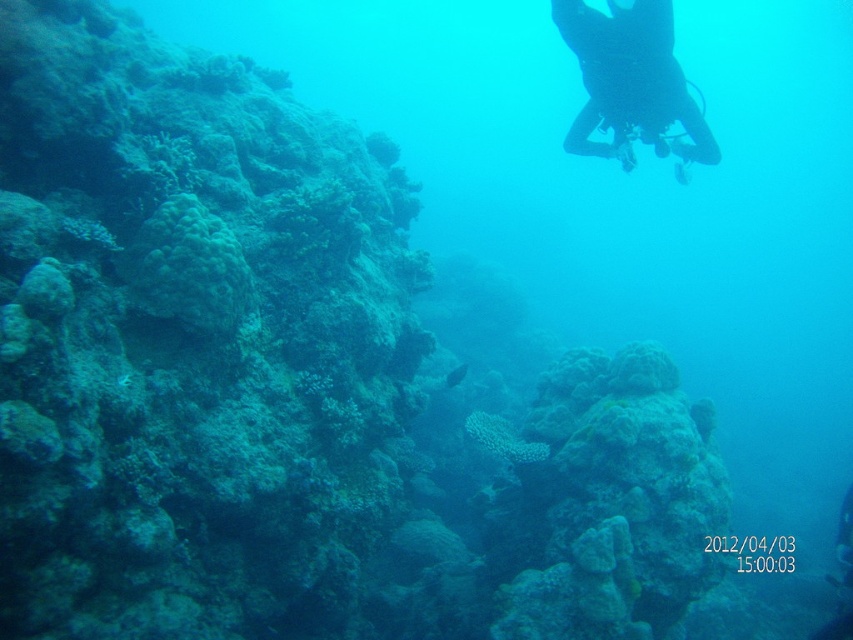
Based on the photo, can you confirm if black matte scuba diver at upper center is smaller than green matte coral at left?

Actually, black matte scuba diver at upper center might be larger than green matte coral at left.

Does black matte scuba diver at upper center appear on the left side of green matte coral at left?

No, black matte scuba diver at upper center is not to the left of green matte coral at left.

At what (x,y) coordinates should I click in order to perform the action: click on black matte scuba diver at upper center. Please return your answer as a coordinate pair (x, y). Looking at the image, I should click on (630, 81).